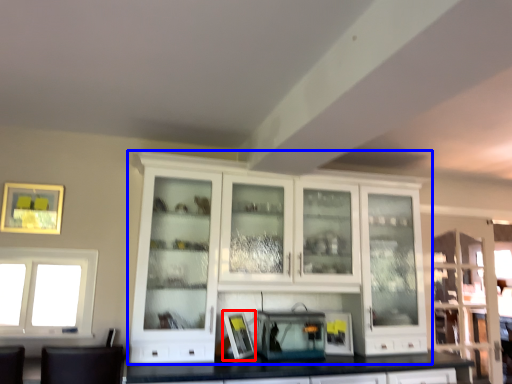
Question: Among these objects, which one is nearest to the camera, picture frame (highlighted by a red box) or cabinetry (highlighted by a blue box)?

Choices:
 (A) picture frame
 (B) cabinetry

Answer: (B)